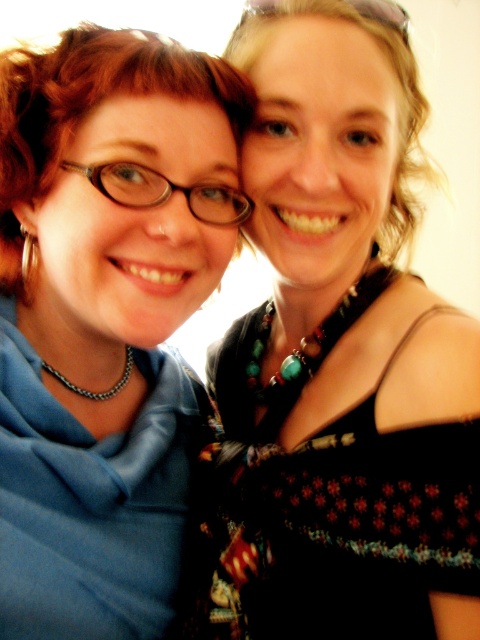
Which is below, matte blue scarf at left or black textured dress at upper right?

black textured dress at upper right is below.

Is point (187, 465) positioned behind point (227, 573)?

Yes.

Is point (39, 266) farther from viewer compared to point (466, 465)?

Yes, point (39, 266) is farther from viewer.

This screenshot has height=640, width=480. In order to click on matte blue scarf at left in this screenshot , I will do `click(106, 320)`.